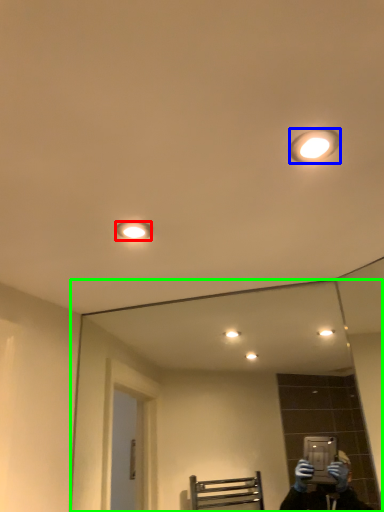
Question: Estimate the real-world distances between objects in this image. Which object is farther from light fixture (highlighted by a red box), light fixture (highlighted by a blue box) or mirror (highlighted by a green box)?

Choices:
 (A) light fixture
 (B) mirror

Answer: (B)